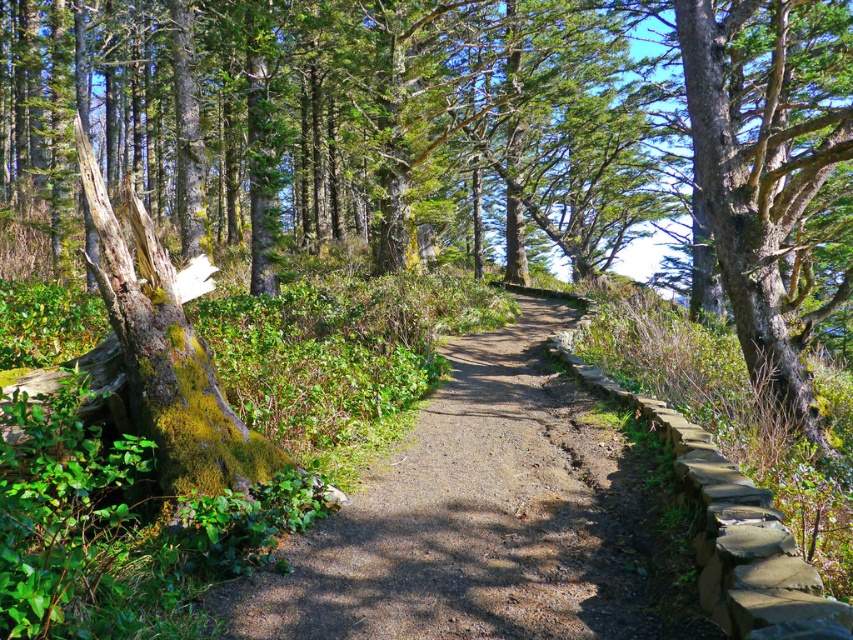
You are a hiker walking along the dirt path at center and the green mossy bark tree at center. Which object is located to the right side of the other?

The dirt path at center is positioned on the left side of green mossy bark tree at center, so the green mossy bark tree at center is to the right of the dirt path at center.

You are a hiker trying to navigate the forest trail. You notice the dirt path at center and the green mossy bark tree at center. Which one takes up more space in the scene?

The green mossy bark tree at center occupies more space than the dirt path at center, so it takes up more space in the scene.